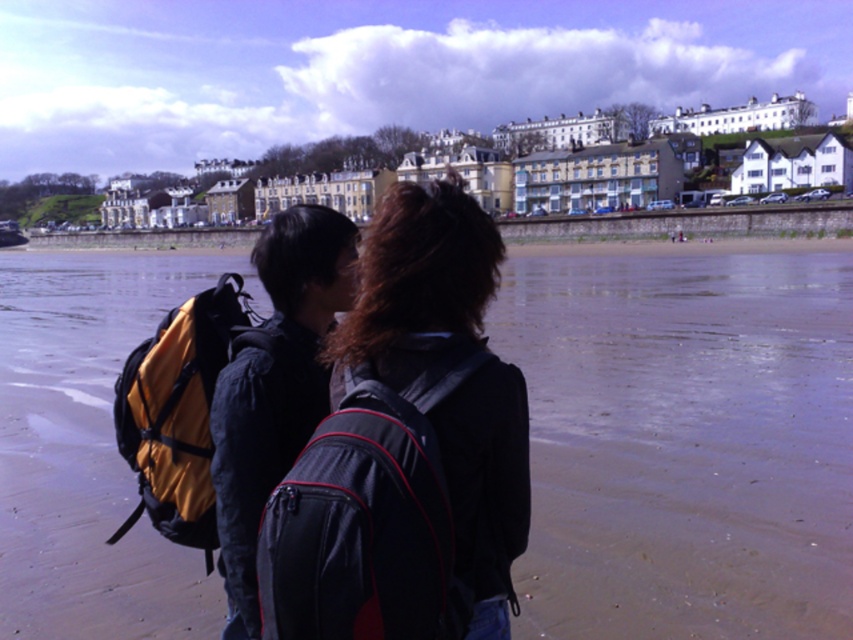
You are a photographer trying to capture both the matte black backpack at center and the yellow fabric backpack at left in a single shot. Since you want both backpacks to be clearly visible, which backpack should you focus on first to ensure depth of field captures both?

You should focus on the matte black backpack at center first because it is closer to the viewer, and by focusing on the closer object, the depth of field will extend further back, potentially capturing the yellow fabric backpack at left which is farther away.

You are a photographer trying to capture a landscape shot of the sandy beach at center. You notice the matte black backpack at center might block the view. Is the backpack taller than the beach in the frame?

The sandy beach at center is shorter than the matte black backpack at center, so the backpack is taller and will block the view of the beach in the frame.